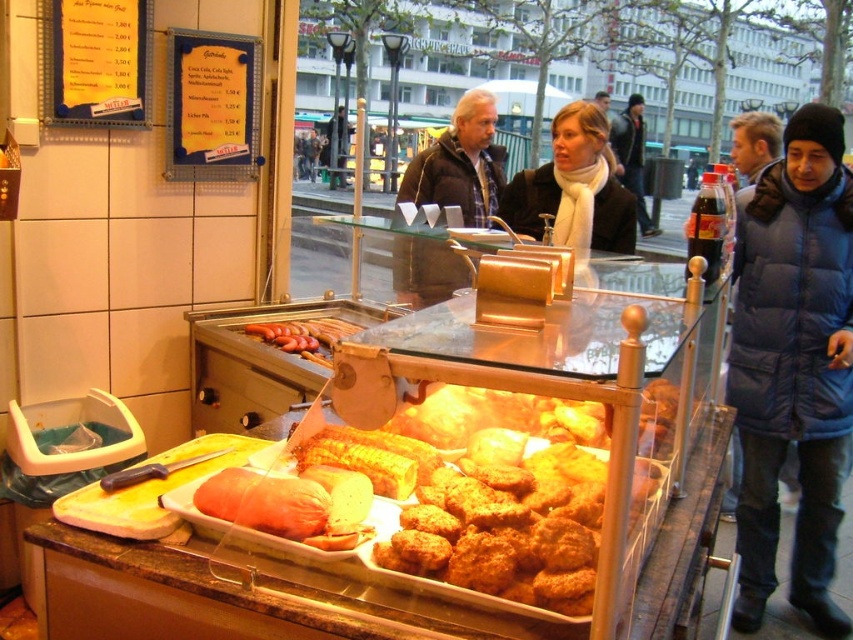
You are standing at point A located at point (x=590, y=145). You want to walk to the food stall located at point B. The path between them is straight. Can you safely walk there without obstacles?

Yes, you can safely walk from point A at point (x=590, y=145) to the food stall at point B because the path is straight and there are no obstacles mentioned in the scene description.